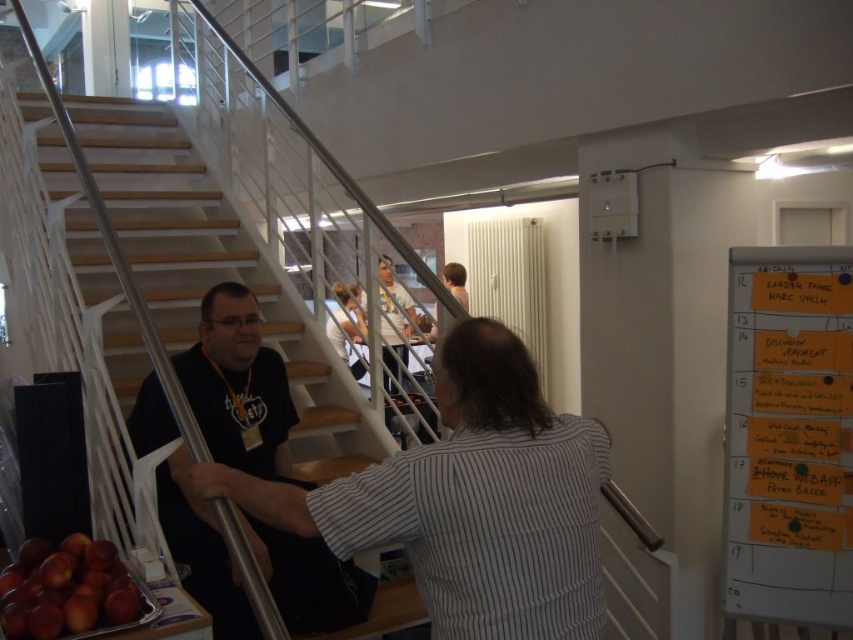
Question: Does orange paper notes at right appear on the right side of red matte apples at lower left?

Choices:
 (A) yes
 (B) no

Answer: (A)

Question: Is matte black shirt at left behind red matte apples at lower left?

Choices:
 (A) no
 (B) yes

Answer: (B)

Question: Is striped cotton shirt at center closer to camera compared to matte black shirt at left?

Choices:
 (A) yes
 (B) no

Answer: (A)

Question: Among these points, which one is nearest to the camera?

Choices:
 (A) (132, 600)
 (B) (158, 445)

Answer: (A)

Question: Which of these objects is positioned farthest from the striped cotton shirt at center?

Choices:
 (A) wooden stairs at lower left
 (B) matte black shirt at left
 (C) orange paper notes at right

Answer: (A)

Question: Estimate the real-world distances between objects in this image. Which object is farther from the matte black shirt at left?

Choices:
 (A) orange paper notes at right
 (B) wooden stairs at lower left
 (C) red matte apples at lower left
 (D) striped cotton shirt at center

Answer: (A)